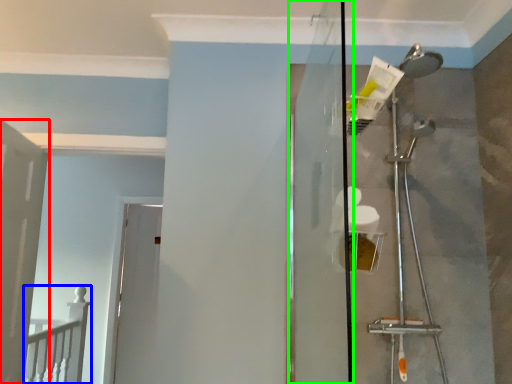
Question: Which object is the farthest from door (highlighted by a red box)? Choose among these: rail (highlighted by a blue box) or screen door (highlighted by a green box).

Choices:
 (A) rail
 (B) screen door

Answer: (B)